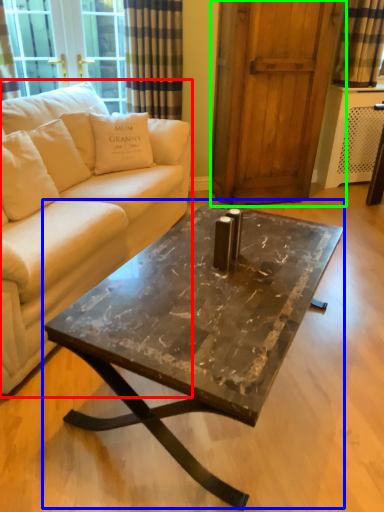
Question: Estimate the real-world distances between objects in this image. Which object is farther from studio couch (highlighted by a red box), coffee table (highlighted by a blue box) or screen door (highlighted by a green box)?

Choices:
 (A) coffee table
 (B) screen door

Answer: (B)